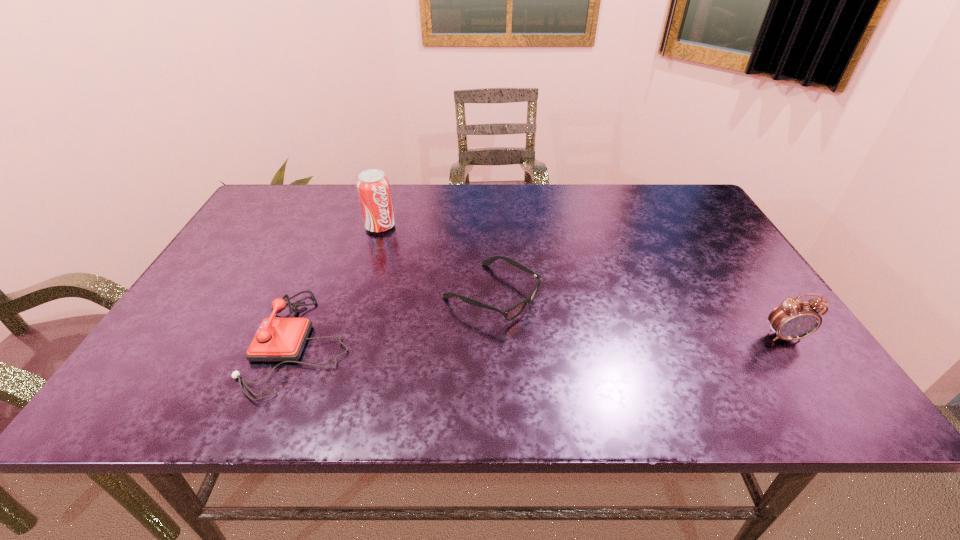
This screenshot has height=540, width=960. I want to click on free spot on the desktop that is between the second shortest object and the second tallest object and is positioned on the logo side of the farthest object, so click(500, 340).

Identify the location of free space on the desktop that is between the second shortest object and the alarm clock and is positioned on the front-facing side of the spectacles. (579, 339).